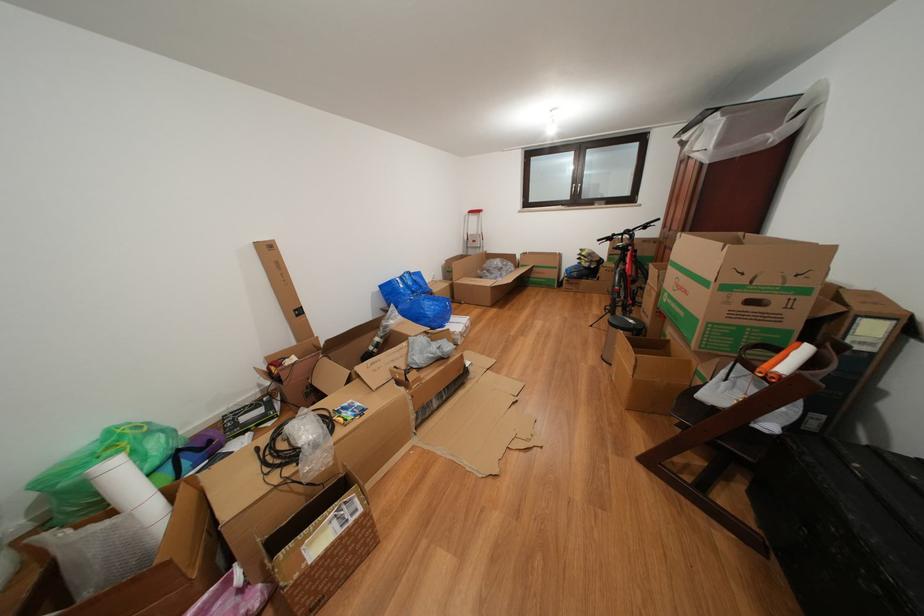
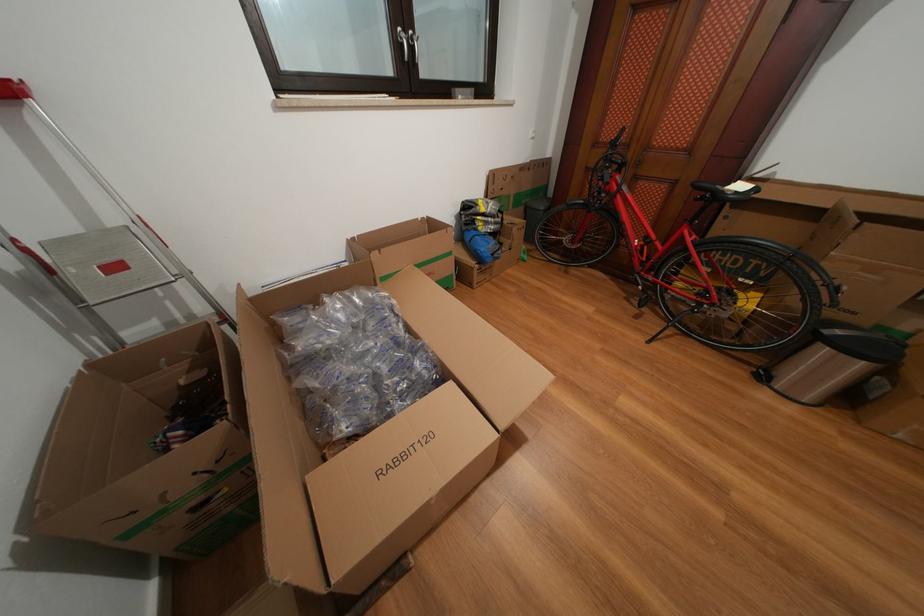
The point at (591, 259) is marked in the first image. Where is the corresponding point in the second image?

(491, 215)